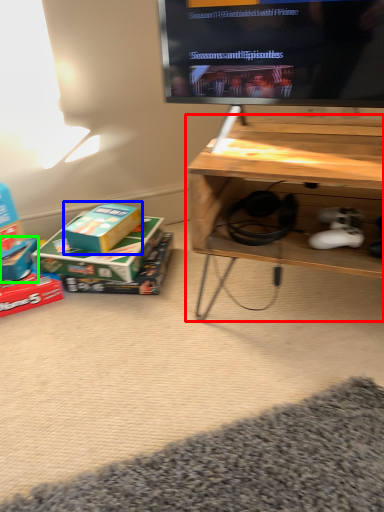
Question: Estimate the real-world distances between objects in this image. Which object is closer to table (highlighted by a red box), box (highlighted by a blue box) or box (highlighted by a green box)?

Choices:
 (A) box
 (B) box

Answer: (A)